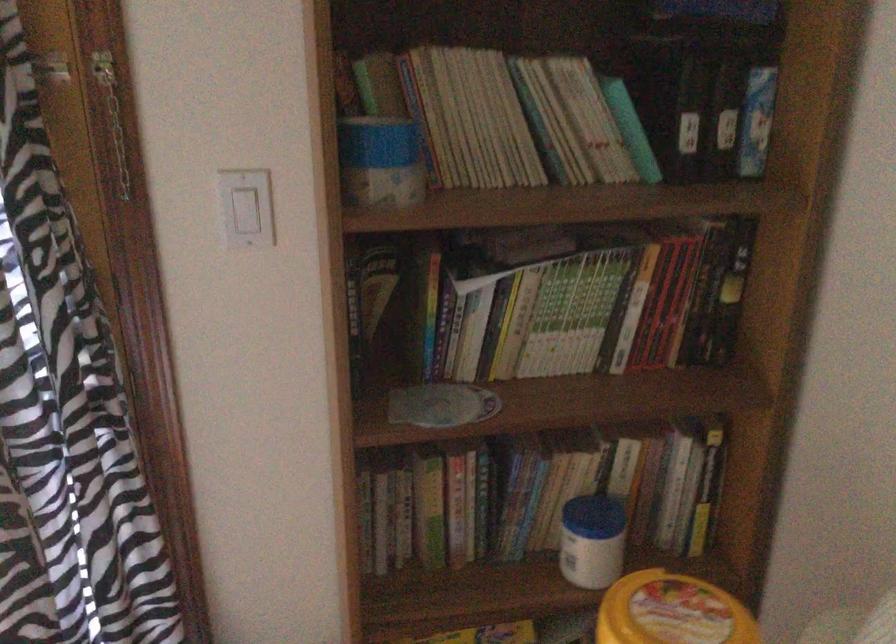
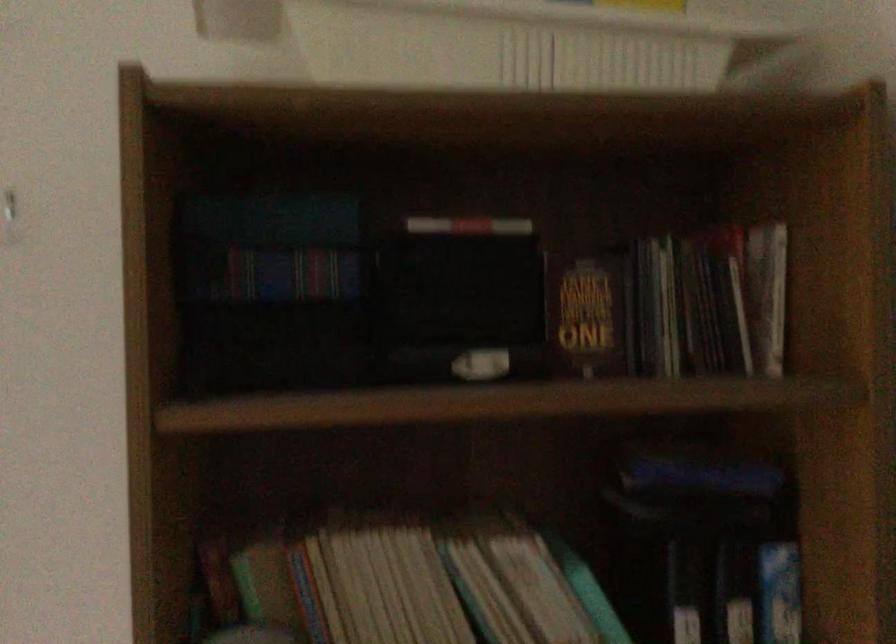
What movement of the cameraman would produce the second image?

The cameraman walked toward right, forward.